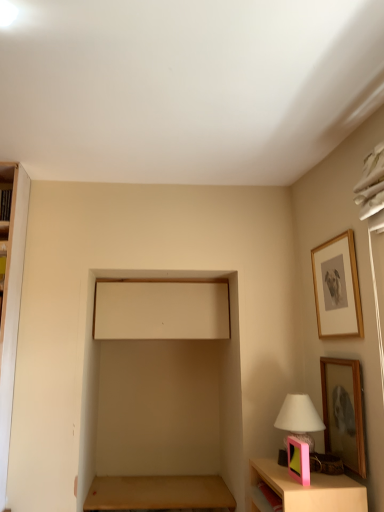
Question: Is wooden picture frame at upper right, the first picture frame positioned from the right, bigger or smaller than pink plastic table lamp at lower right?

Choices:
 (A) small
 (B) big

Answer: (A)

Question: Do you think wooden picture frame at upper right, the first picture frame positioned from the right, is within pink plastic table lamp at lower right, or outside of it?

Choices:
 (A) inside
 (B) outside

Answer: (B)

Question: Based on their relative distances, which object is nearer to the pink plastic picture frame at lower right, which appears as the first picture frame when viewed from the left?

Choices:
 (A) wooden picture frame at lower right, positioned as the second picture frame in bottom-to-top order
 (B) white matte window screen at center
 (C) pink plastic table lamp at lower right
 (D) brown wooden table at lower center
 (E) wooden picture frame at upper right, which is counted as the third picture frame, starting from the bottom

Answer: (C)

Question: Estimate the real-world distances between objects in this image. Which object is farther from the brown wooden table at lower center?

Choices:
 (A) pink plastic table lamp at lower right
 (B) pink plastic picture frame at lower right, the third picture frame when ordered from top to bottom
 (C) white matte window screen at center
 (D) wooden picture frame at lower right, the second picture frame positioned from the right
 (E) wooden picture frame at upper right, the first picture frame positioned from the right

Answer: (E)